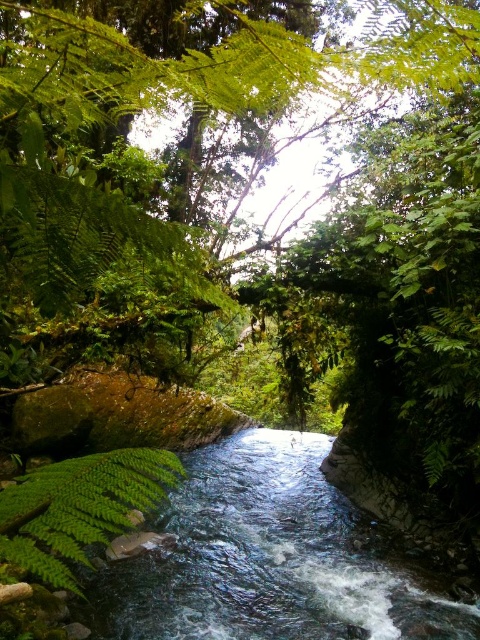
Question: Can you confirm if clear water stream at center is wider than green leafy fern at center?

Choices:
 (A) no
 (B) yes

Answer: (B)

Question: Which of the following is the closest to the observer?

Choices:
 (A) pyautogui.click(x=7, y=492)
 (B) pyautogui.click(x=459, y=636)

Answer: (A)

Question: Does clear water stream at center have a lesser width compared to green leafy fern at center?

Choices:
 (A) yes
 (B) no

Answer: (B)

Question: Is clear water stream at center smaller than green leafy fern at center?

Choices:
 (A) no
 (B) yes

Answer: (A)

Question: Among these points, which one is nearest to the camera?

Choices:
 (A) (19, 499)
 (B) (321, 481)

Answer: (A)